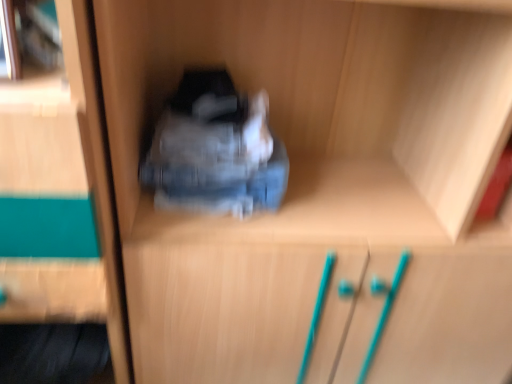
The height and width of the screenshot is (384, 512). In order to click on denim at center in this screenshot , I will do `click(215, 150)`.

This screenshot has width=512, height=384. What do you see at coordinates (215, 150) in the screenshot?
I see `denim at center` at bounding box center [215, 150].

I want to click on denim at center, so click(215, 150).